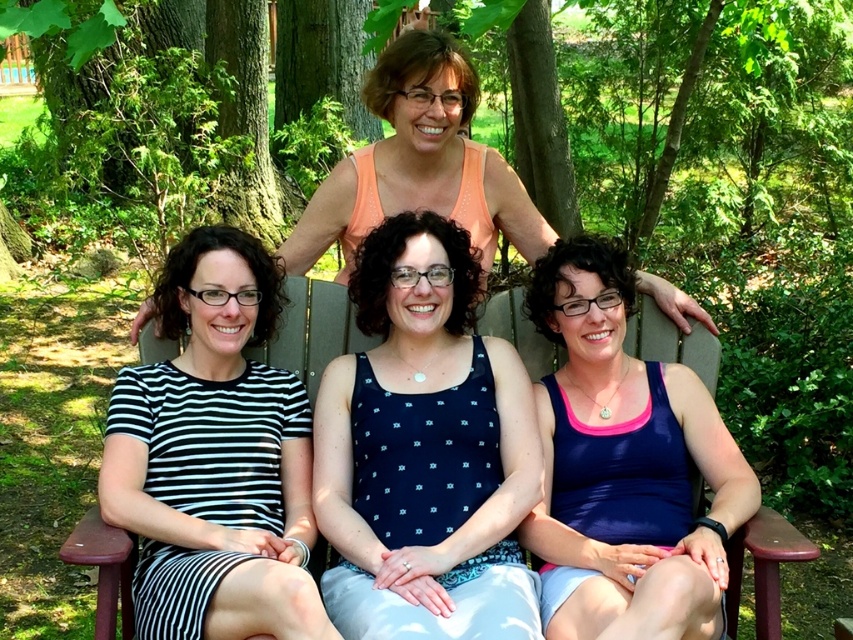
You are a photographer trying to capture a clear shot of the blue fabric tank top at lower right and the orange tank top at upper center. Which one is closer to the camera?

The blue fabric tank top at lower right is closer to the camera because it is in front of the orange tank top at upper center.

Consider the image. You are a photographer trying to capture a photo of the blue fabric tank top at lower right and the orange tank top at upper center. Which tank top should you focus on to ensure it appears larger in the photo?

The blue fabric tank top at lower right should be focused on because it is much taller than the orange tank top at upper center, making it appear larger in the photo.